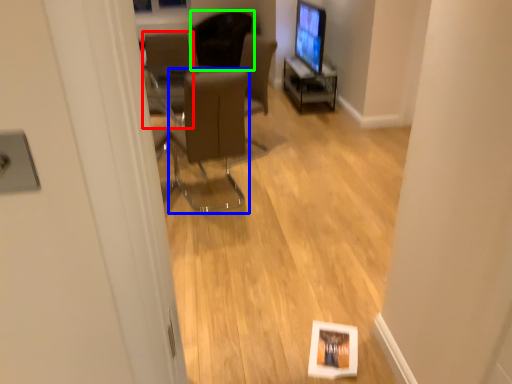
Question: Which is nearer to the chair (highlighted by a red box)? chair (highlighted by a blue box) or chair (highlighted by a green box).

Choices:
 (A) chair
 (B) chair

Answer: (B)